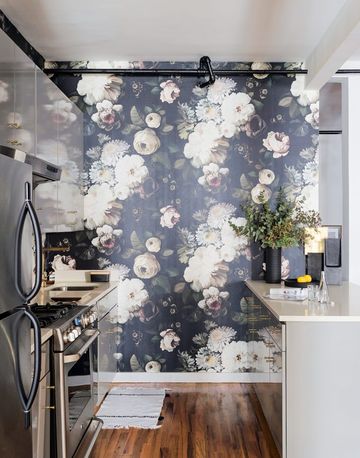
You are a GUI agent. You are given a task and a screenshot of the screen. Output one action in this format:
    pyautogui.click(x=<x>, y=<y>)
    Task: Click on the freezer compartment
    
    Given the screenshot: What is the action you would take?
    pyautogui.click(x=17, y=258)